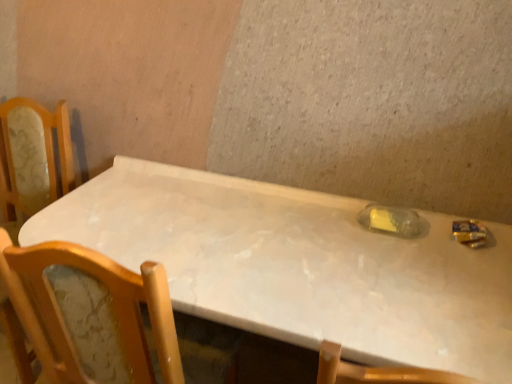
Question: From a real-world perspective, is white marble table at center on translucent plastic bottle at center?

Choices:
 (A) yes
 (B) no

Answer: (B)

Question: Is white marble table at center far away from translucent plastic bottle at center?

Choices:
 (A) yes
 (B) no

Answer: (B)

Question: Is white marble table at center outside of translucent plastic bottle at center?

Choices:
 (A) yes
 (B) no

Answer: (A)

Question: From the image's perspective, is white marble table at center under translucent plastic bottle at center?

Choices:
 (A) yes
 (B) no

Answer: (A)

Question: Does white marble table at center have a larger size compared to translucent plastic bottle at center?

Choices:
 (A) no
 (B) yes

Answer: (B)

Question: From the image's perspective, would you say white marble table at center is positioned over translucent plastic bottle at center?

Choices:
 (A) yes
 (B) no

Answer: (B)

Question: Is translucent plastic bottle at center taller than white marble table at center?

Choices:
 (A) yes
 (B) no

Answer: (B)

Question: Is translucent plastic bottle at center located outside white marble table at center?

Choices:
 (A) yes
 (B) no

Answer: (B)

Question: Is translucent plastic bottle at center at the right side of white marble table at center?

Choices:
 (A) no
 (B) yes

Answer: (B)

Question: Is translucent plastic bottle at center oriented towards white marble table at center?

Choices:
 (A) no
 (B) yes

Answer: (B)

Question: Does translucent plastic bottle at center have a lesser width compared to white marble table at center?

Choices:
 (A) yes
 (B) no

Answer: (A)

Question: Can you confirm if translucent plastic bottle at center is shorter than white marble table at center?

Choices:
 (A) yes
 (B) no

Answer: (A)

Question: From a real-world perspective, is white marble table at center positioned above or below translucent plastic bottle at center?

Choices:
 (A) above
 (B) below

Answer: (B)